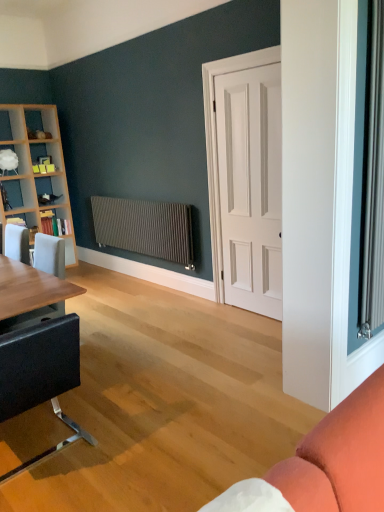
Question: Visually, is white matte door at center positioned to the left or to the right of wooden bookshelf at left, which is the third shelf in top-to-bottom order?

Choices:
 (A) right
 (B) left

Answer: (A)

Question: Considering the positions of white matte door at center and wooden bookshelf at left, which is the third shelf in top-to-bottom order, in the image, is white matte door at center taller or shorter than wooden bookshelf at left, which is the third shelf in top-to-bottom order,?

Choices:
 (A) short
 (B) tall

Answer: (B)

Question: Estimate the real-world distances between objects in this image. Which object is farther from the wooden bookshelf at left, the first shelf in the bottom-to-top sequence?

Choices:
 (A) white glossy shelf at upper left, which appears as the 1th shelf when viewed from the top
 (B) white matte door at center
 (C) matte black table at left
 (D) black leather chair at lower left
 (E) wooden bookshelf at left, arranged as the 2th shelf when viewed from the top

Answer: (B)

Question: Based on their relative distances, which object is nearer to the black leather chair at lower left?

Choices:
 (A) white glossy shelf at upper left, which appears as the 1th shelf when viewed from the top
 (B) matte black table at left
 (C) wooden bookshelf at left, which is counted as the second shelf, starting from the bottom
 (D) matte metallic radiator at center
 (E) white matte door at center

Answer: (B)